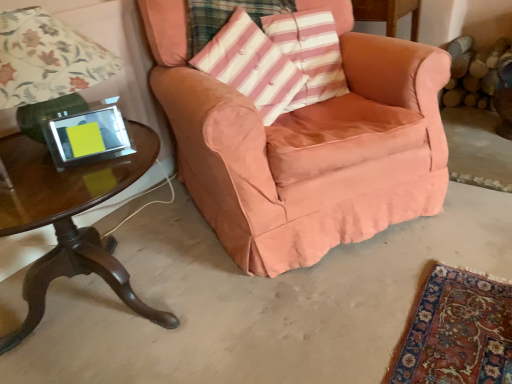
Question: Considering the positions of suede-like peach armchair at center and pink striped cushion at upper center in the image, is suede-like peach armchair at center wider or thinner than pink striped cushion at upper center?

Choices:
 (A) wide
 (B) thin

Answer: (A)

Question: From a real-world perspective, relative to pink striped cushion at upper center, is suede-like peach armchair at center vertically above or below?

Choices:
 (A) below
 (B) above

Answer: (A)

Question: Estimate the real-world distances between objects in this image. Which object is farther from the matte green lamp at left?

Choices:
 (A) pink striped fabric pillow at center
 (B) pink striped cushion at upper center
 (C) suede-like peach armchair at center
 (D) shiny dark wood table at lower left

Answer: (B)

Question: Estimate the real-world distances between objects in this image. Which object is closer to the suede-like peach armchair at center?

Choices:
 (A) shiny dark wood table at lower left
 (B) matte green lamp at left
 (C) pink striped cushion at upper center
 (D) pink striped fabric pillow at center

Answer: (D)